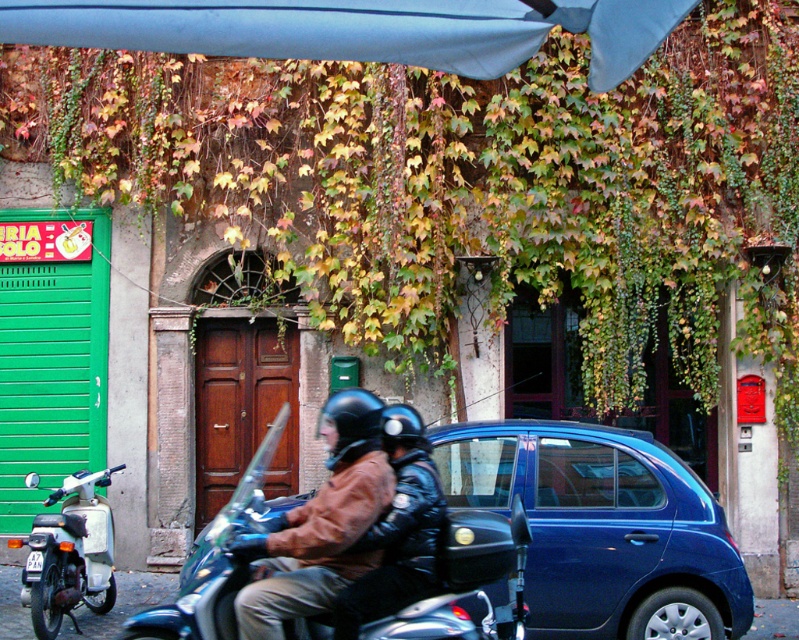
Which is more to the left, shiny chrome scooter at center or black matte helmet at center?

black matte helmet at center

In the scene shown: Does shiny chrome scooter at center have a lesser width compared to black matte helmet at center?

No.

Between point (348, 468) and point (370, 410), which one is positioned in front?

Point (348, 468) is in front.

Where is `shiny chrome scooter at center`? Image resolution: width=799 pixels, height=640 pixels. shiny chrome scooter at center is located at coordinates (344, 548).

The width and height of the screenshot is (799, 640). I want to click on blue metallic car at center, so click(x=602, y=528).

Between blue metallic car at center and blue fabric umbrella at upper center, which one has more height?

Standing taller between the two is blue metallic car at center.

Who is more forward, [682,600] or [338,49]?

Point [338,49] is in front.

Where is `blue metallic car at center`? blue metallic car at center is located at coordinates (602, 528).

This screenshot has width=799, height=640. Describe the element at coordinates (356, 29) in the screenshot. I see `blue fabric umbrella at upper center` at that location.

Does blue fabric umbrella at upper center appear on the right side of white plastic license plate at center?

Yes, blue fabric umbrella at upper center is to the right of white plastic license plate at center.

This screenshot has width=799, height=640. Identify the location of blue fabric umbrella at upper center. (356, 29).